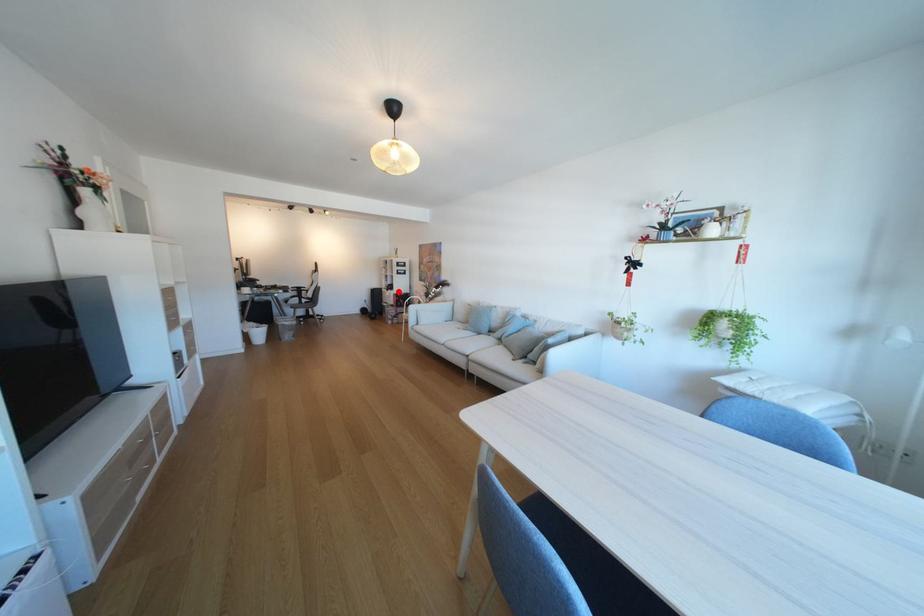
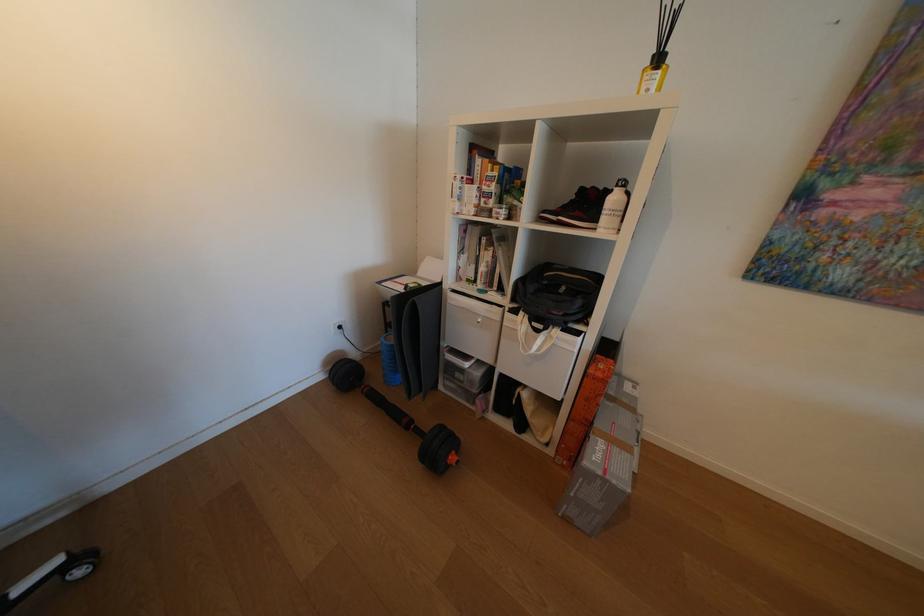
The point at the highlighted location is marked in the first image. Where is the corresponding point in the second image?

(548, 331)